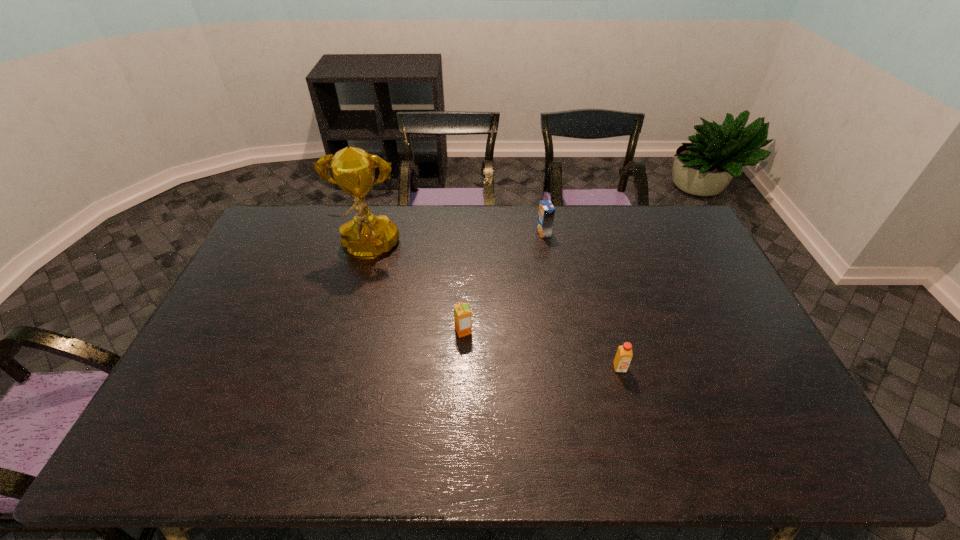
Identify the location of vacant space that is in between the rightmost object and the second object from right to left. This screenshot has height=540, width=960. (582, 300).

Find the location of a particular element. free spot between the second nearest object and the nearest orange juice is located at coordinates (541, 349).

This screenshot has width=960, height=540. Find the location of `vacant space that is in between the rightmost orange juice and the third object from right to left`. vacant space that is in between the rightmost orange juice and the third object from right to left is located at coordinates (541, 349).

Locate an element on the screen. This screenshot has height=540, width=960. empty location between the leftmost orange juice and the leftmost object is located at coordinates (416, 291).

Locate an element on the screen. free area in between the third object from left to right and the third farthest object is located at coordinates pos(504,281).

At what (x,y) coordinates should I click in order to perform the action: click on free space that is in between the second object from right to left and the nearest orange juice. Please return your answer as a coordinate pair (x, y). This screenshot has height=540, width=960. Looking at the image, I should click on (582, 300).

The image size is (960, 540). Identify the location of vacant point located between the leftmost object and the second orange juice from right to left. click(x=456, y=241).

Where is `free area in between the third object from right to left and the award`? The height and width of the screenshot is (540, 960). free area in between the third object from right to left and the award is located at coordinates (416, 291).

Locate an element on the screen. vacant space that is in between the farthest orange juice and the leftmost orange juice is located at coordinates (504, 281).

Find the location of `free area in between the award and the nearest object`. free area in between the award and the nearest object is located at coordinates (493, 309).